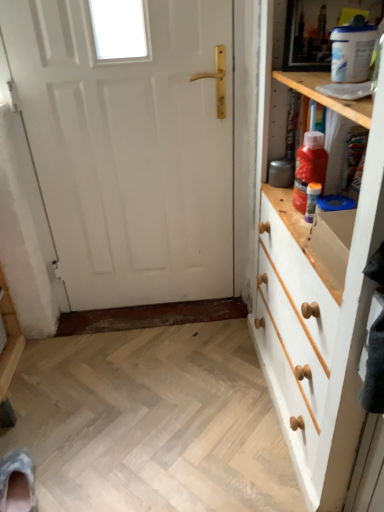
Question: Considering the relative sizes of red plastic bottle at upper right, the 2th bottle in the bottom-to-top sequence, and camouflage fabric shoe at lower left in the image provided, is red plastic bottle at upper right, the 2th bottle in the bottom-to-top sequence, smaller than camouflage fabric shoe at lower left?

Choices:
 (A) no
 (B) yes

Answer: (B)

Question: Is red plastic bottle at upper right, the 2th bottle in the bottom-to-top sequence, bigger than camouflage fabric shoe at lower left?

Choices:
 (A) no
 (B) yes

Answer: (A)

Question: Does red plastic bottle at upper right, the 2th bottle in the bottom-to-top sequence, have a greater height compared to camouflage fabric shoe at lower left?

Choices:
 (A) no
 (B) yes

Answer: (B)

Question: Considering the relative positions of red plastic bottle at upper right, arranged as the first bottle when viewed from the top, and camouflage fabric shoe at lower left in the image provided, is red plastic bottle at upper right, arranged as the first bottle when viewed from the top, to the right of camouflage fabric shoe at lower left from the viewer's perspective?

Choices:
 (A) no
 (B) yes

Answer: (B)

Question: Can you confirm if red plastic bottle at upper right, the 2th bottle in the bottom-to-top sequence, is shorter than camouflage fabric shoe at lower left?

Choices:
 (A) no
 (B) yes

Answer: (A)

Question: In terms of height, does white painted wood chest of drawers at right look taller or shorter compared to red plastic bottle at upper right, the 2th bottle in the bottom-to-top sequence?

Choices:
 (A) short
 (B) tall

Answer: (B)

Question: In terms of size, does white painted wood chest of drawers at right appear bigger or smaller than red plastic bottle at upper right, arranged as the first bottle when viewed from the top?

Choices:
 (A) small
 (B) big

Answer: (B)

Question: Is white painted wood chest of drawers at right spatially inside red plastic bottle at upper right, arranged as the first bottle when viewed from the top, or outside of it?

Choices:
 (A) outside
 (B) inside

Answer: (A)

Question: In the image, is white painted wood chest of drawers at right positioned in front of or behind red plastic bottle at upper right, arranged as the first bottle when viewed from the top?

Choices:
 (A) behind
 (B) front

Answer: (B)

Question: In terms of size, does white painted wood chest of drawers at right appear bigger or smaller than camouflage fabric shoe at lower left?

Choices:
 (A) small
 (B) big

Answer: (B)

Question: Do you think white painted wood chest of drawers at right is within camouflage fabric shoe at lower left, or outside of it?

Choices:
 (A) inside
 (B) outside

Answer: (B)

Question: Is point (379, 145) positioned closer to the camera than point (13, 505)?

Choices:
 (A) farther
 (B) closer

Answer: (B)

Question: Considering the positions of white painted wood chest of drawers at right and camouflage fabric shoe at lower left in the image, is white painted wood chest of drawers at right wider or thinner than camouflage fabric shoe at lower left?

Choices:
 (A) thin
 (B) wide

Answer: (B)

Question: Based on their sizes in the image, would you say red plastic bottle at upper right, arranged as the first bottle when viewed from the top, is bigger or smaller than white painted wood chest of drawers at right?

Choices:
 (A) big
 (B) small

Answer: (B)

Question: In terms of height, does red plastic bottle at upper right, arranged as the first bottle when viewed from the top, look taller or shorter compared to white painted wood chest of drawers at right?

Choices:
 (A) tall
 (B) short

Answer: (B)